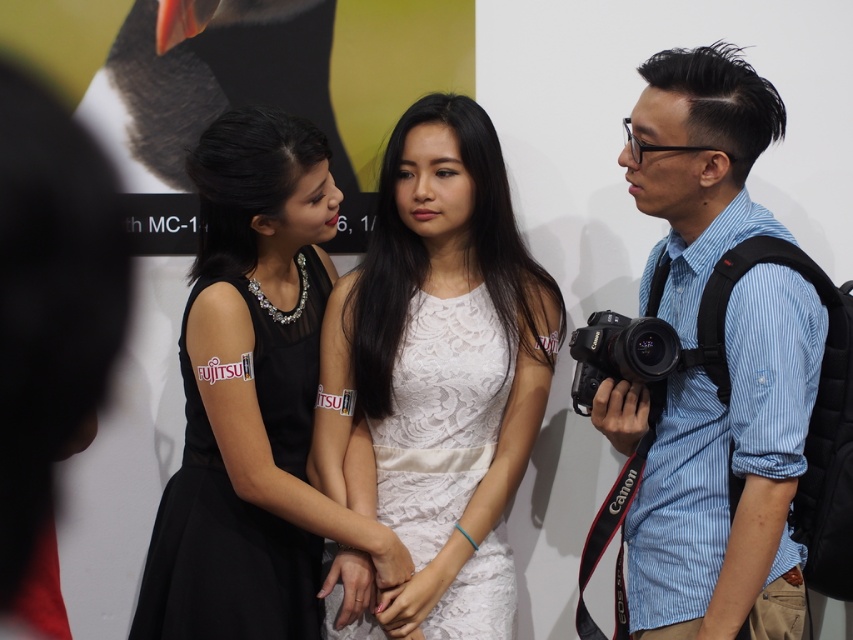
You are a photographer at the event and want to take a photo focusing on the blue striped shirt at right and the black lace dress at center. Which one will appear larger in the photo?

The blue striped shirt at right appears larger in the photo because it is closer to the viewer than the black lace dress at center.

You are taking a photo of the promotional event. You want to focus on the point at the bottom right corner of the image. Which point, point [751,625] or point [416,401], is closer to the camera and thus better for focusing?

Point [751,625] is closer to the camera than point [416,401], so it is better for focusing.